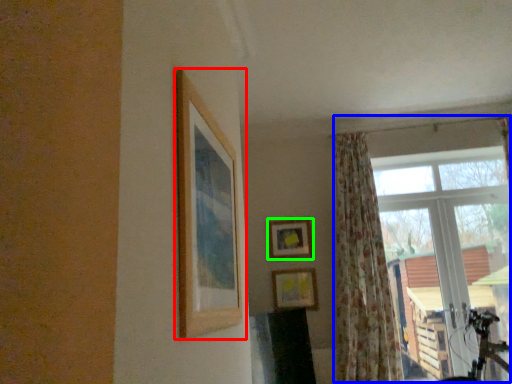
Question: Which is farther away from picture frame (highlighted by a red box)? window (highlighted by a blue box) or picture frame (highlighted by a green box)?

Choices:
 (A) window
 (B) picture frame

Answer: (A)